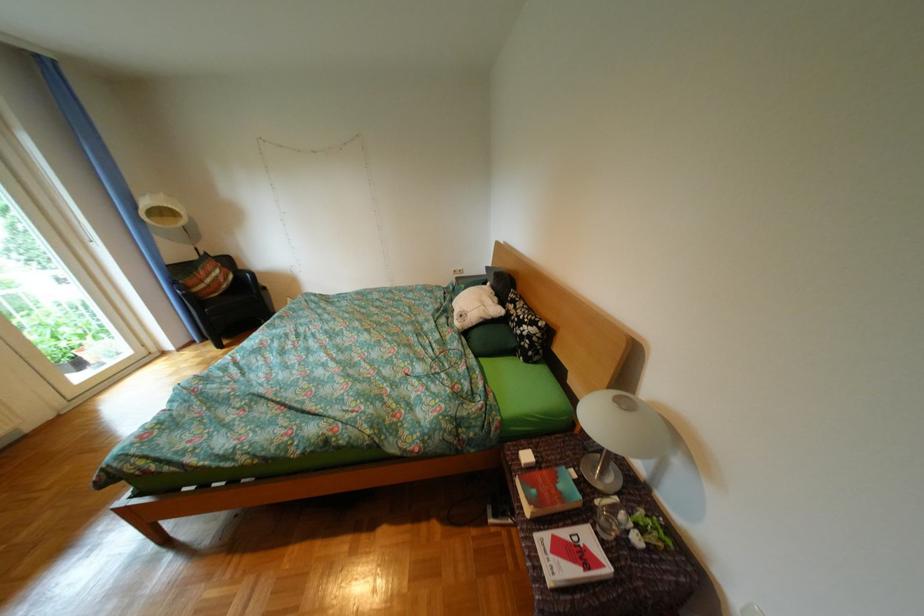
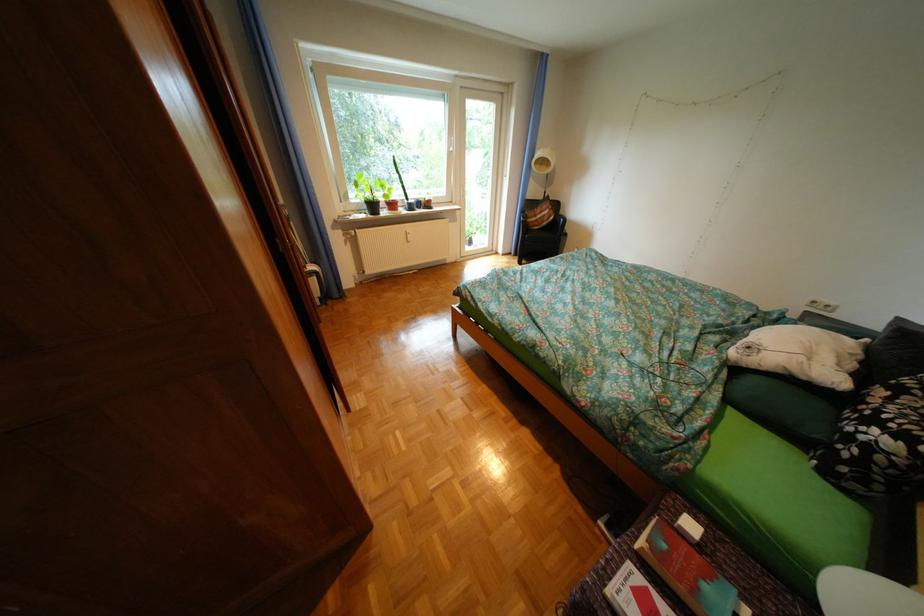
Find the pixel in the second image that matches the point at 529,309 in the first image.

(904, 399)